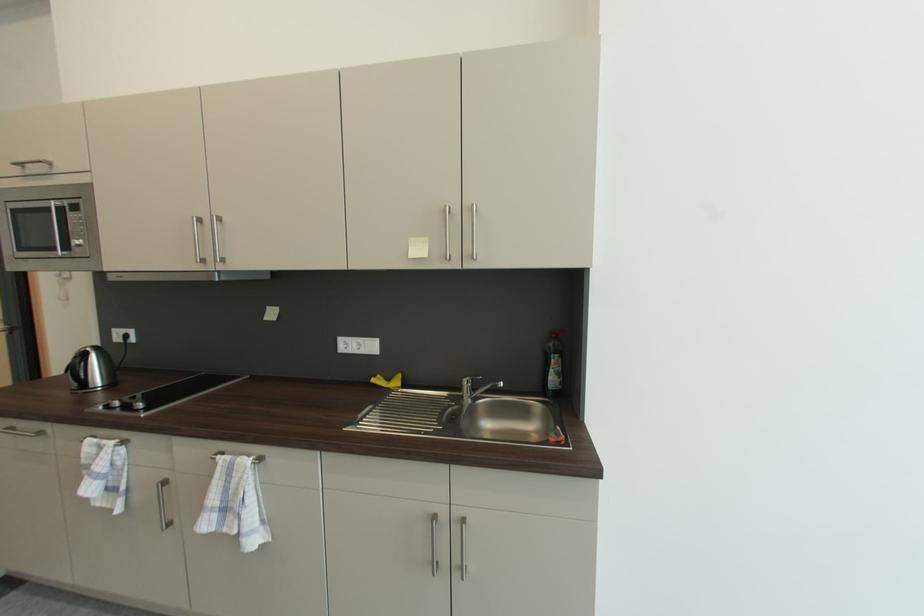
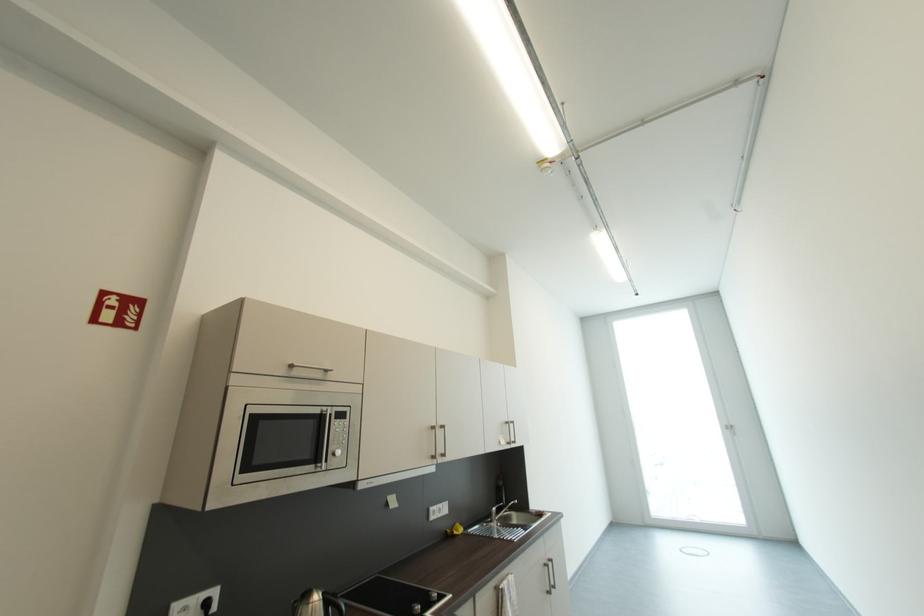
Find the pixel in the second image that matches (x=132, y=338) in the first image.

(213, 605)